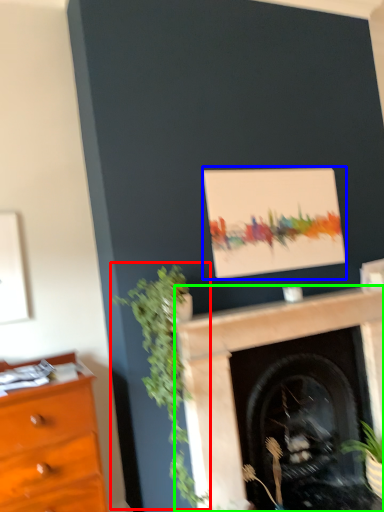
Question: Which object is the farthest from plant (highlighted by a red box)? Choose among these: picture frame (highlighted by a blue box) or fireplace (highlighted by a green box).

Choices:
 (A) picture frame
 (B) fireplace

Answer: (A)